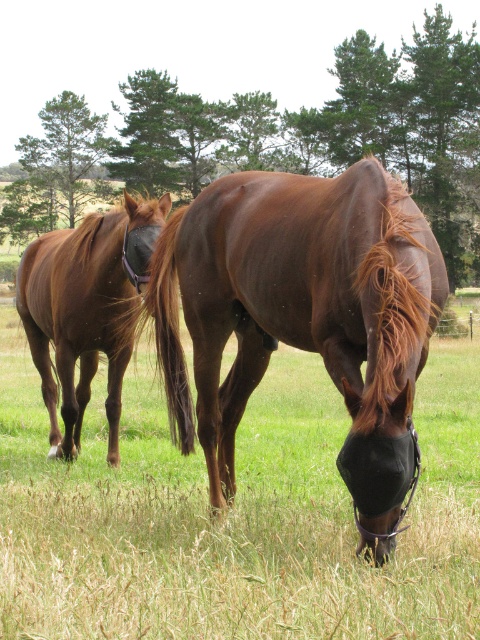
There are two horses in the field, a brown leather horse at center and another horse slightly behind and to the left. How far apart are they?

The brown leather horse at center and the other horse are 8.07 feet apart.

You are standing in the field and want to walk from point (242, 452) to point (375, 221). Which direction should you move relative to your current position?

You should move towards the upper left direction because point (375, 221) is behind and to the left of point (242, 452).

You are a farmer checking the field. You see the brown leather horse at center and the brown glossy horse at left. Which horse would appear bigger to you?

The brown leather horse at center appears bigger than the brown glossy horse at left.